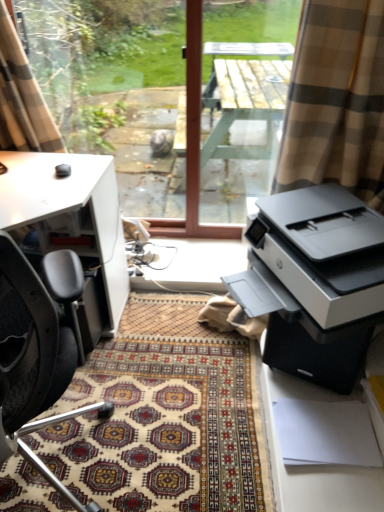
This screenshot has height=512, width=384. Identify the location of blank space situated above matte black printer at right (from a real-world perspective). (321, 220).